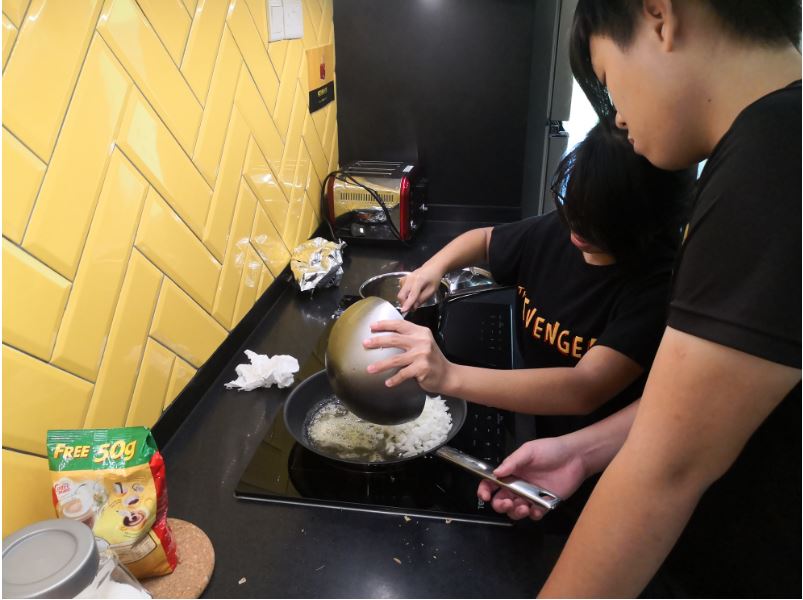
Identify the location of stove. The width and height of the screenshot is (803, 600). (352, 477).